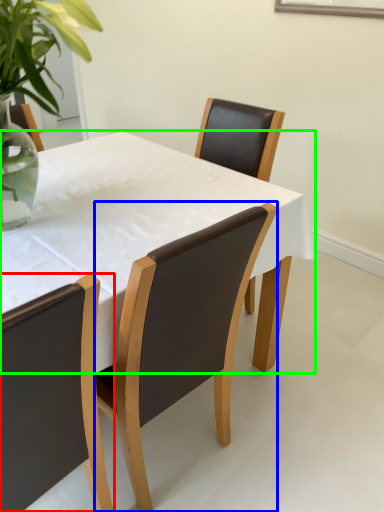
Question: Considering the real-world distances, which object is farthest from chair (highlighted by a red box)? chair (highlighted by a blue box) or kitchen & dining room table (highlighted by a green box)?

Choices:
 (A) chair
 (B) kitchen & dining room table

Answer: (B)